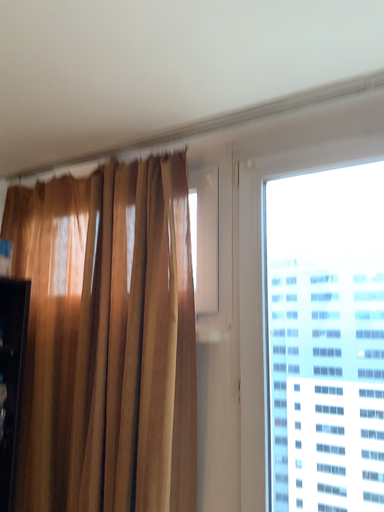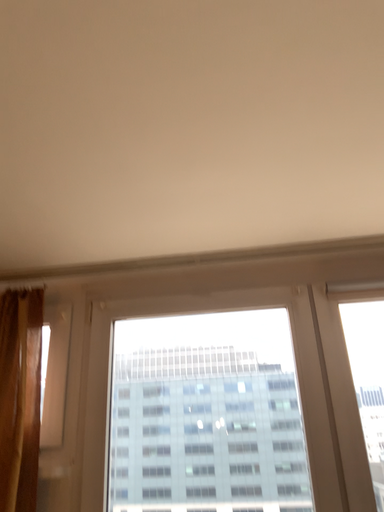
Question: Which way did the camera rotate in the video?

Choices:
 (A) rotated right
 (B) rotated left

Answer: (A)